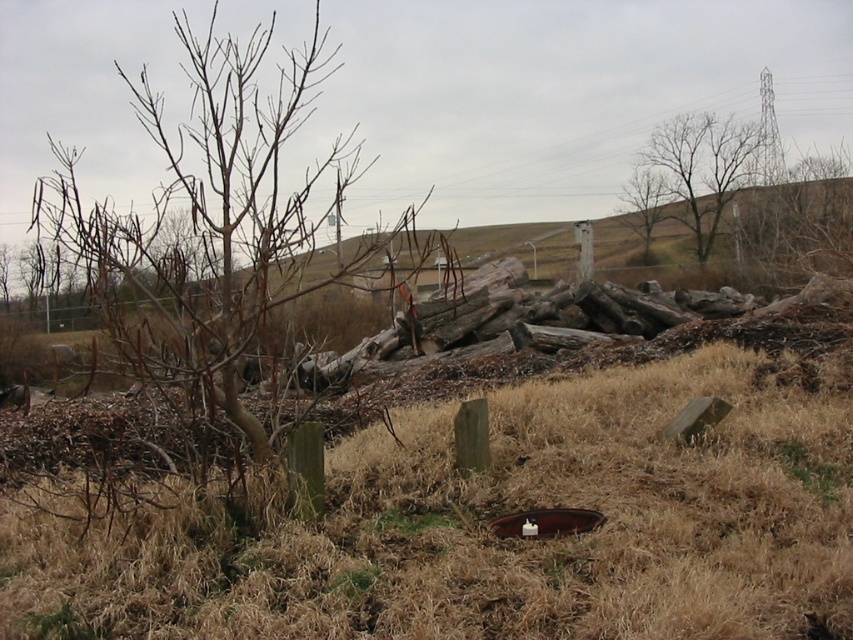
Describe the element at coordinates (502, 515) in the screenshot. I see `brown dry grass at center` at that location.

Does brown dry grass at center have a lesser height compared to brown wood tree at upper center?

Correct, brown dry grass at center is not as tall as brown wood tree at upper center.

Is point (648, 404) positioned after point (656, 212)?

No, (648, 404) is in front of (656, 212).

You are a GUI agent. You are given a task and a screenshot of the screen. Output one action in this format:
    pyautogui.click(x=<x>, y=<y>)
    Task: Click on the brown dry grass at center
    
    Given the screenshot: What is the action you would take?
    pyautogui.click(x=502, y=515)

Consider the image. Can you confirm if bare wood tree at upper right is thinner than brown wood tree at upper center?

Yes.

Is bare wood tree at upper right to the left of brown wood tree at upper center from the viewer's perspective?

Incorrect, bare wood tree at upper right is not on the left side of brown wood tree at upper center.

Is point (722, 198) positioned before point (653, 176)?

Yes, point (722, 198) is closer to viewer.

Find the location of `bare wood tree at upper right`. bare wood tree at upper right is located at coordinates (700, 168).

Is brown dry grass at center shorter than bare wood tree at upper right?

No, brown dry grass at center is not shorter than bare wood tree at upper right.

Does brown dry grass at center lie in front of bare wood tree at upper right?

That is True.

Does point (758, 586) come closer to viewer compared to point (744, 179)?

Yes, point (758, 586) is closer to viewer.

This screenshot has width=853, height=640. Identify the location of brown dry grass at center. (502, 515).